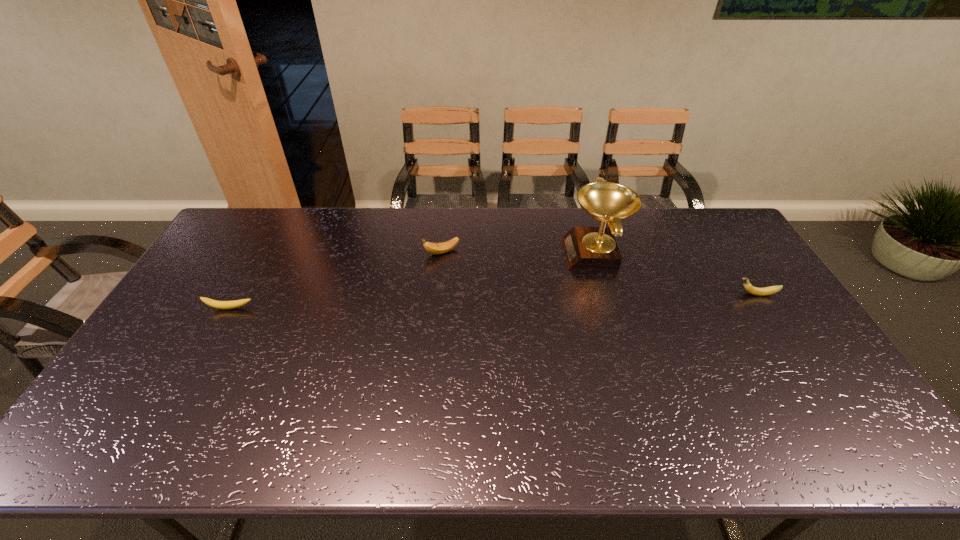
In order to click on blank space at the far edge of the desktop in this screenshot , I will do `click(672, 240)`.

Where is `blank area at the near edge`? blank area at the near edge is located at coordinates (547, 448).

In the image, there is a desktop. At what (x,y) coordinates should I click in order to perform the action: click on vacant space at the right edge. Please return your answer as a coordinate pair (x, y). Looking at the image, I should click on (761, 303).

Identify the location of vacant space at the far right corner of the desktop. Image resolution: width=960 pixels, height=540 pixels. [x=701, y=216].

The image size is (960, 540). I want to click on free space between the nearest object and the rightmost banana, so pyautogui.click(x=492, y=301).

Where is `free space between the rightmost object and the second banana from left to right`? free space between the rightmost object and the second banana from left to right is located at coordinates tap(599, 273).

I want to click on vacant point located between the second object from right to left and the nearest banana, so click(413, 281).

Image resolution: width=960 pixels, height=540 pixels. I want to click on free space that is in between the nearest object and the rightmost banana, so click(x=492, y=301).

Locate an element on the screen. empty space between the second nearest banana and the nearest object is located at coordinates (492, 301).

Locate an element on the screen. free spot between the second nearest banana and the award is located at coordinates (676, 274).